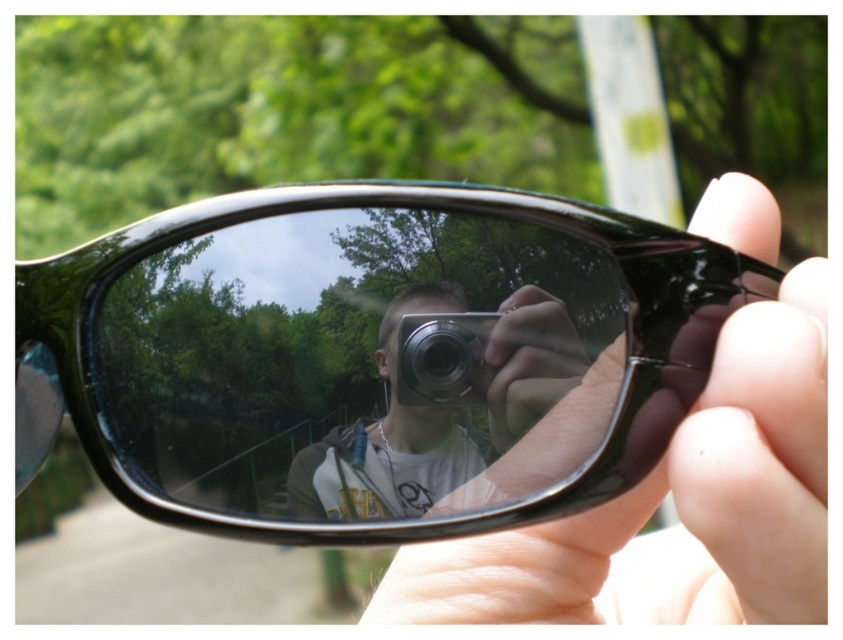
Who is shorter, smooth skin hand at center or silver metallic camera at center?

With less height is silver metallic camera at center.

Measure the distance between point (760, 253) and camera.

Point (760, 253) is 16.44 inches from camera.

The image size is (843, 640). Identify the location of smooth skin hand at center. (675, 506).

Can you confirm if black shiny sunglasses at center is wider than silver metallic camera at center?

Indeed, black shiny sunglasses at center has a greater width compared to silver metallic camera at center.

Looking at this image, is black shiny sunglasses at center to the right of silver metallic camera at center from the viewer's perspective?

No, black shiny sunglasses at center is not to the right of silver metallic camera at center.

Which is behind, point (19, 486) or point (323, 488)?

The point (19, 486) is more distant.

Locate an element on the screen. This screenshot has width=843, height=640. black shiny sunglasses at center is located at coordinates (368, 356).

Is smooth skin hand at center wider than matte black hand at center?

Yes.

Is smooth skin hand at center positioned in front of matte black hand at center?

Yes.

Which is in front, point (685, 589) or point (554, 337)?

Point (554, 337) is more forward.

Locate an element on the screen. This screenshot has height=640, width=843. smooth skin hand at center is located at coordinates pyautogui.click(x=675, y=506).